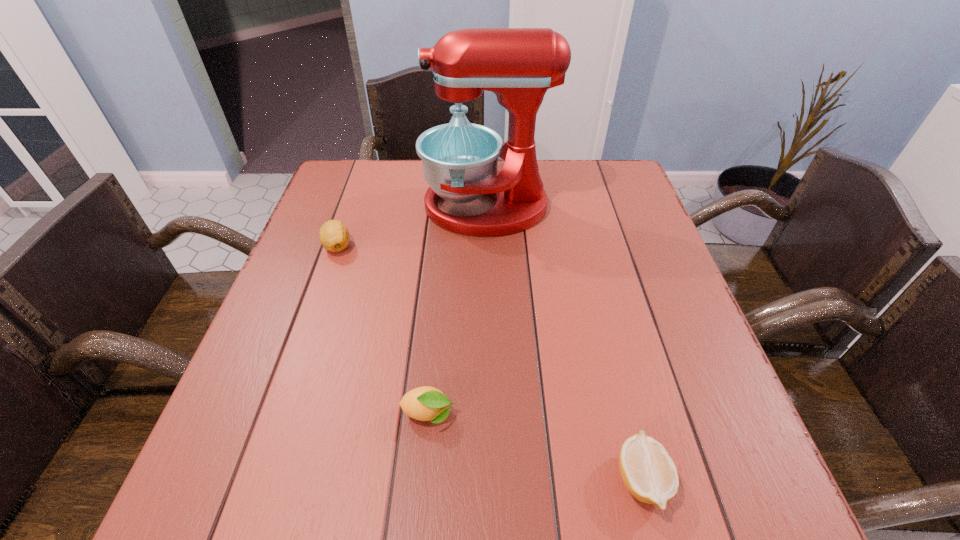
Where is `vacant point located at the stem end of the farthest lemon`? This screenshot has width=960, height=540. vacant point located at the stem end of the farthest lemon is located at coordinates (318, 303).

The image size is (960, 540). What are the coordinates of `free spot located 0.060m with leaves positioned above the third farthest object` in the screenshot? It's located at (491, 414).

Locate an element on the screen. free space located 0.200m on the back of the rightmost lemon is located at coordinates (608, 345).

The width and height of the screenshot is (960, 540). Identify the location of object located at the far edge. (460, 159).

Where is `object that is at the near edge`? object that is at the near edge is located at coordinates (648, 472).

The height and width of the screenshot is (540, 960). Find the location of `object present at the left edge`. object present at the left edge is located at coordinates (334, 236).

This screenshot has width=960, height=540. Find the location of `object at the right edge`. object at the right edge is located at coordinates (648, 472).

Where is `object that is at the near right corner`? The image size is (960, 540). object that is at the near right corner is located at coordinates (648, 472).

Where is `vacant space at the far edge of the desktop`? The width and height of the screenshot is (960, 540). vacant space at the far edge of the desktop is located at coordinates (403, 176).

At what (x,y) coordinates should I click in order to perform the action: click on vacant region at the near edge of the desktop. Please return your answer as a coordinate pair (x, y). This screenshot has height=540, width=960. Looking at the image, I should click on (380, 516).